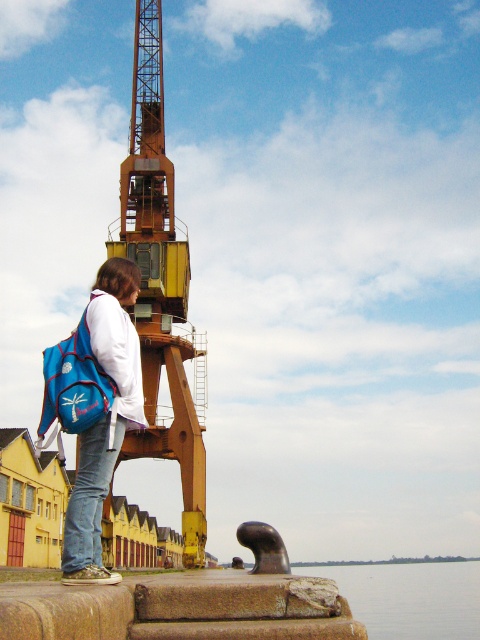
Question: Which of these objects is positioned closest to the yellow painted metal crane at center?

Choices:
 (A) jeans at lower left
 (B) blue fabric backpack at center
 (C) clear water at lower right

Answer: (B)

Question: Does blue fabric backpack at center have a smaller size compared to jeans at lower left?

Choices:
 (A) no
 (B) yes

Answer: (A)

Question: Does yellow painted metal crane at center have a greater width compared to blue fabric backpack at center?

Choices:
 (A) no
 (B) yes

Answer: (B)

Question: Which of these objects is positioned closest to the clear water at lower right?

Choices:
 (A) jeans at lower left
 (B) yellow painted metal crane at center
 (C) blue fabric backpack at center

Answer: (B)

Question: Which object is positioned closest to the yellow painted metal crane at center?

Choices:
 (A) jeans at lower left
 (B) clear water at lower right
 (C) blue fabric backpack at center

Answer: (C)

Question: Observing the image, what is the correct spatial positioning of blue fabric backpack at center in reference to jeans at lower left?

Choices:
 (A) below
 (B) above

Answer: (B)